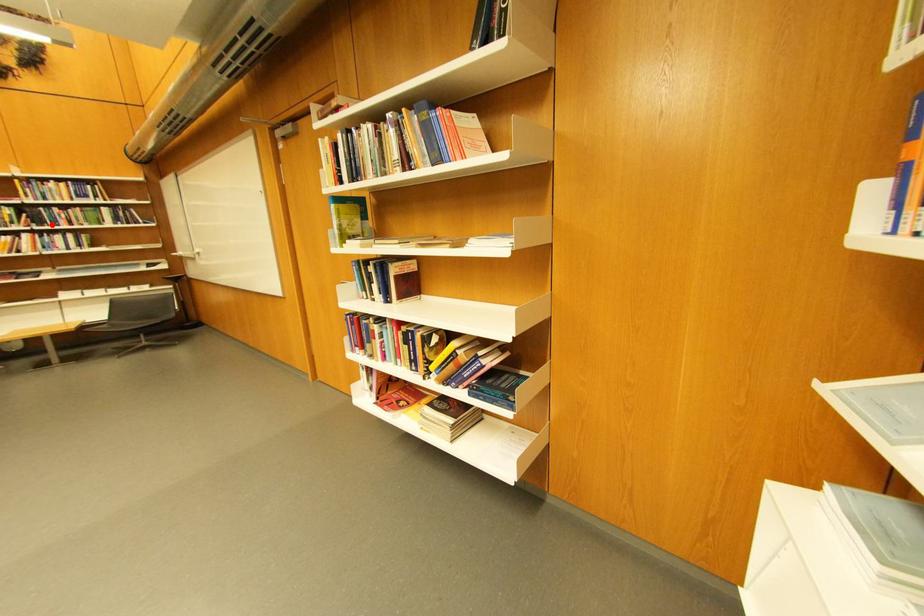
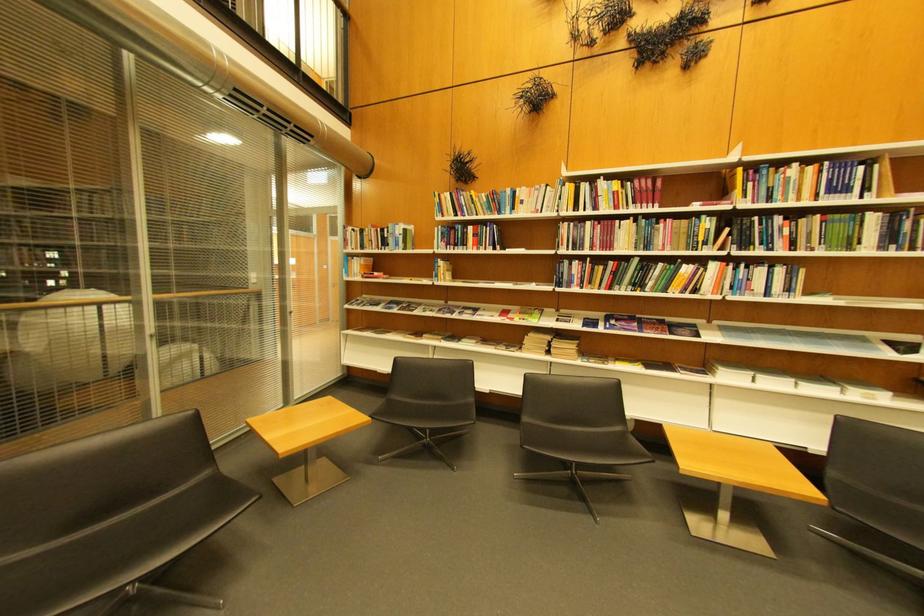
In the second image, find the point that corresponds to the highlighted location in the first image.

(756, 246)